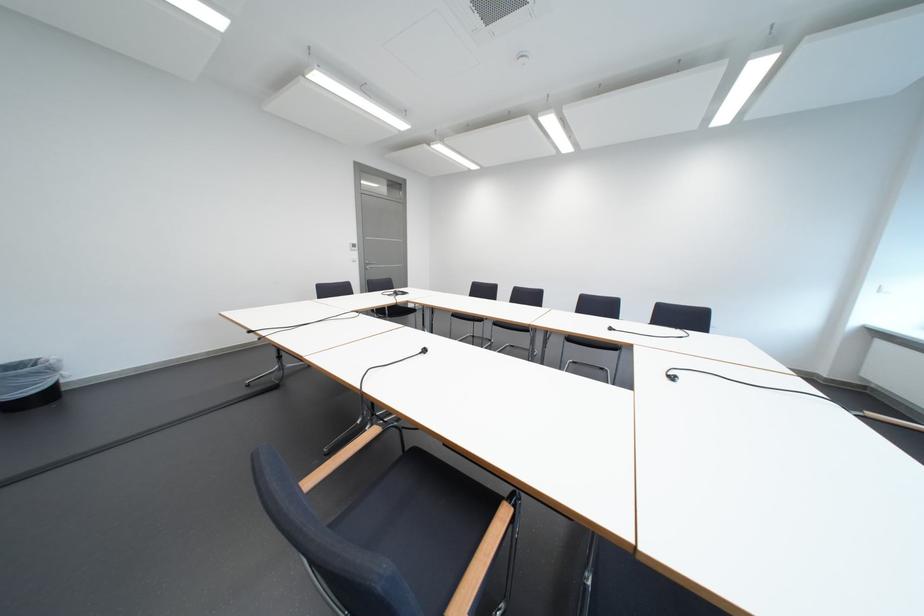
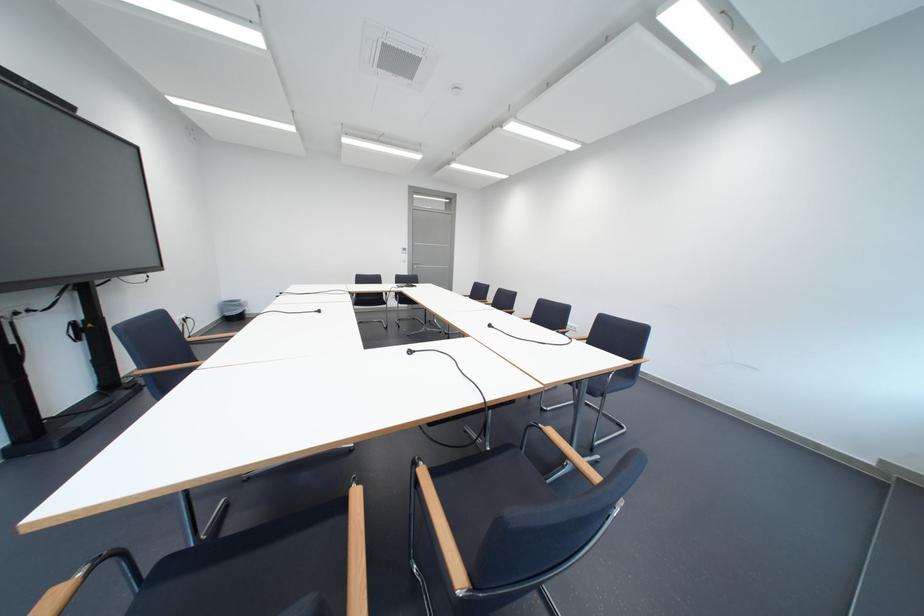
Question: I am providing you with two images of the same scene from different viewpoints. Which of the following objects are not visible in image2?

Choices:
 (A) blue chair sitting surface
 (B) wooden chair armrest
 (C) printer touchscreen
 (D) chair sitting surface

Answer: (A)